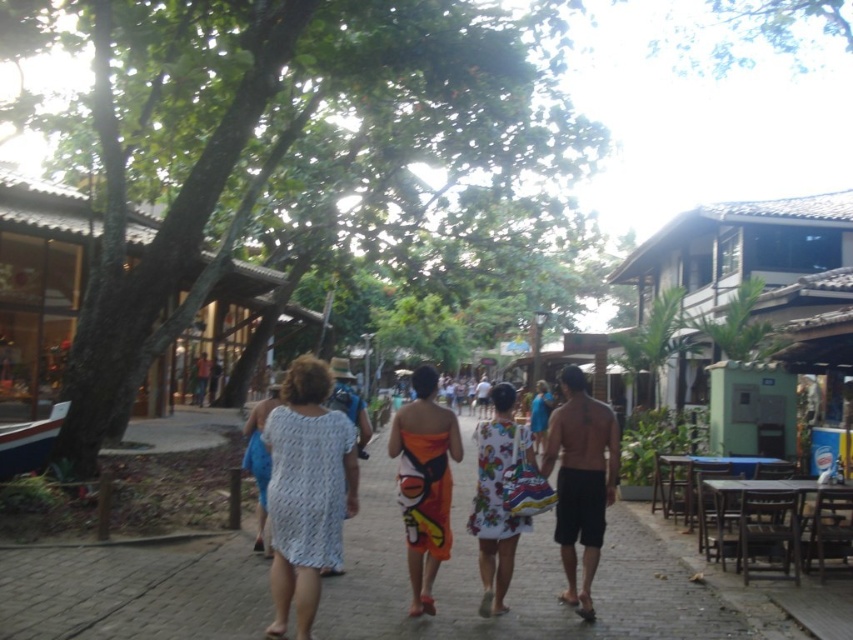
How much distance is there between brown cobblestone pavement at center and white knitted dress at center?

A distance of 6.56 feet exists between brown cobblestone pavement at center and white knitted dress at center.

Does point (112, 556) come behind point (274, 428)?

Yes.

The image size is (853, 640). In order to click on brown cobblestone pavement at center in this screenshot , I will do `click(512, 579)`.

In the scene shown: Is white knitted dress at center further to camera compared to orange printed sarong at center?

No.

Where is `white knitted dress at center`? white knitted dress at center is located at coordinates (306, 492).

Between white knitted dress at center and white printed dress at center, which one is positioned lower?

Positioned lower is white printed dress at center.

Is white knitted dress at center below white printed dress at center?

Actually, white knitted dress at center is above white printed dress at center.

This screenshot has height=640, width=853. Describe the element at coordinates (306, 492) in the screenshot. I see `white knitted dress at center` at that location.

What are the coordinates of `white knitted dress at center` in the screenshot? It's located at (306, 492).